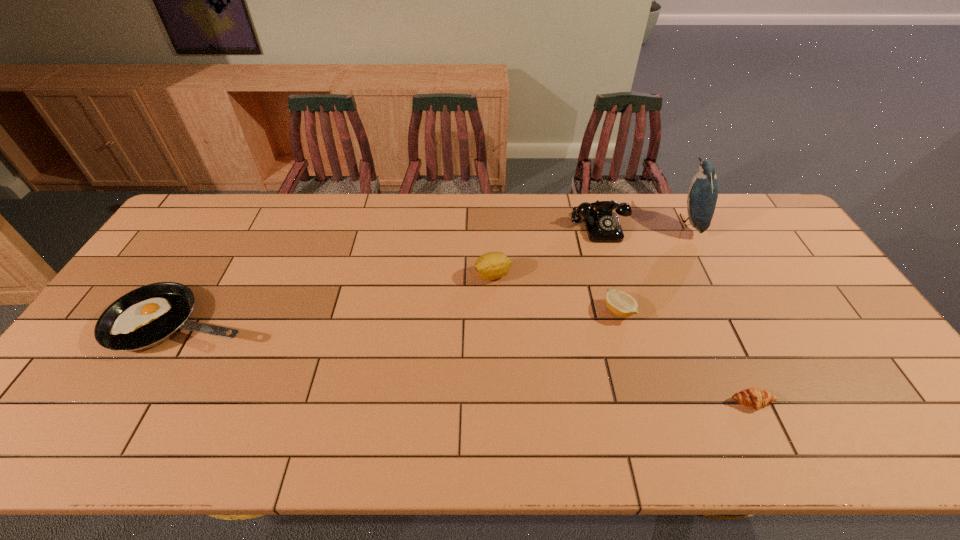
This screenshot has width=960, height=540. In order to click on free area in between the shortest object and the telephone in this screenshot , I will do `click(676, 315)`.

You are a GUI agent. You are given a task and a screenshot of the screen. Output one action in this format:
    pyautogui.click(x=<x>, y=<y>)
    Task: Click on the empty space between the shortest object and the telephone
    The height and width of the screenshot is (540, 960).
    Given the screenshot: What is the action you would take?
    pyautogui.click(x=676, y=315)

Find the location of a particular element. empty space that is in between the pastry and the nearer lemon is located at coordinates (685, 356).

Identify the location of free space between the bird and the frying pan. (436, 272).

The image size is (960, 540). What are the coordinates of `empty space that is in between the frying pan and the nearest object` in the screenshot? It's located at (468, 362).

At what (x,y) coordinates should I click in order to perform the action: click on object that stands as the second closest to the frying pan. Please return your answer as a coordinate pair (x, y). Looking at the image, I should click on (602, 224).

Identify which object is located as the second nearest to the telephone. Please provide its 2D coordinates. Your answer should be formatted as a tuple, i.e. [(x, y)], where the tuple contains the x and y coordinates of a point satisfying the conditions above.

[(492, 265)]

Where is `vacant region that satisfies the following two spatial constraints: 1. at the tip of the bird's beak; 2. on the front side of the right lemon`? vacant region that satisfies the following two spatial constraints: 1. at the tip of the bird's beak; 2. on the front side of the right lemon is located at coordinates (735, 310).

This screenshot has width=960, height=540. Find the location of `vacant space that satisfies the following two spatial constraints: 1. at the tip of the bird's beak; 2. on the front-facing side of the nearest object`. vacant space that satisfies the following two spatial constraints: 1. at the tip of the bird's beak; 2. on the front-facing side of the nearest object is located at coordinates (782, 402).

What are the coordinates of `free location that satisfies the following two spatial constraints: 1. at the stem end of the right lemon; 2. on the right side of the second object from left to right` in the screenshot? It's located at (494, 310).